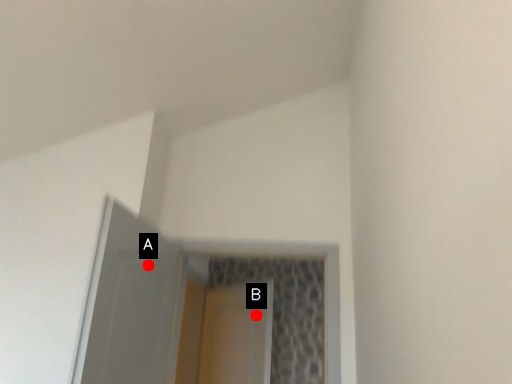
Question: Two points are circled on the image, labeled by A and B beside each circle. Among these points, which one is nearest to the camera?

Choices:
 (A) A is closer
 (B) B is closer

Answer: (A)